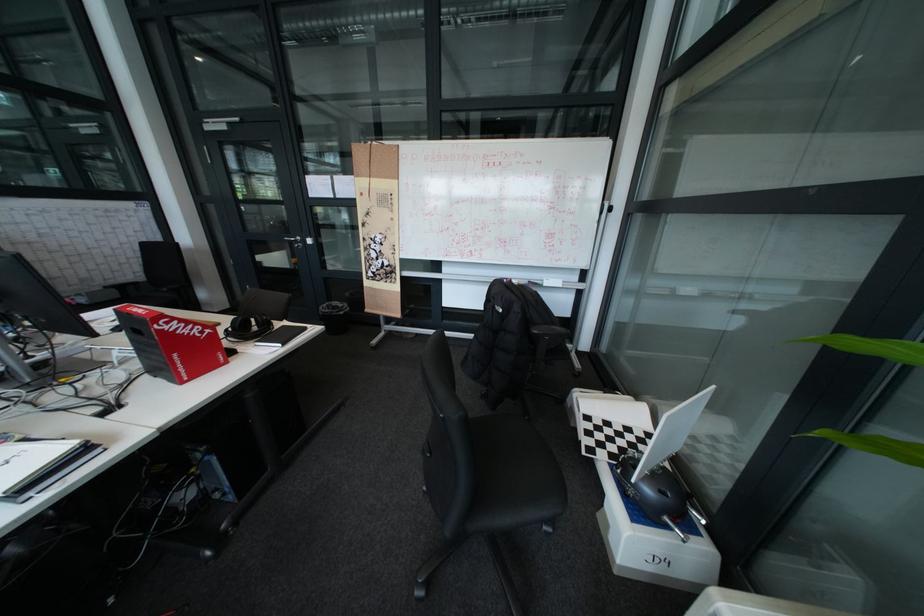
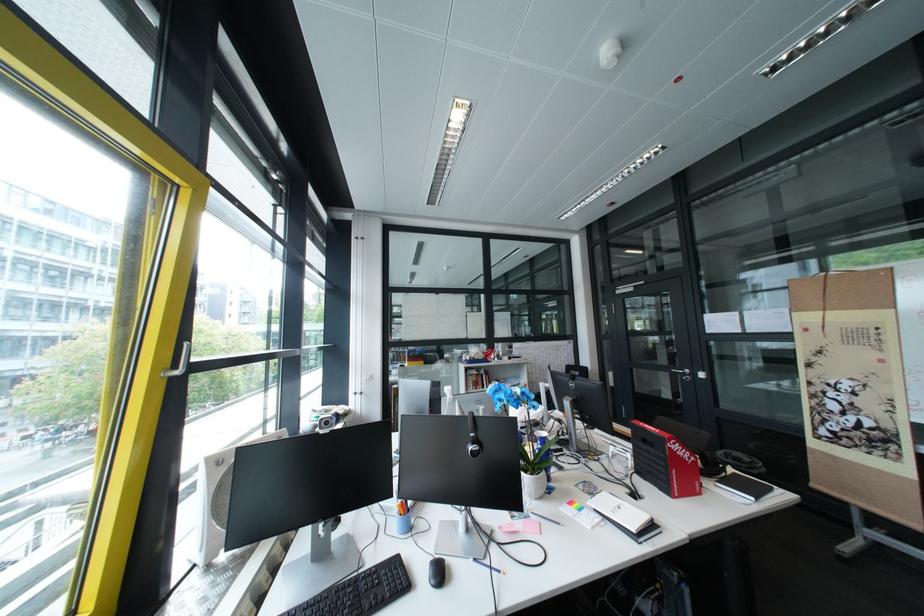
The first image is from the beginning of the video and the second image is from the end. How did the camera likely rotate when shooting the video?

The camera's rotation is toward left-up.